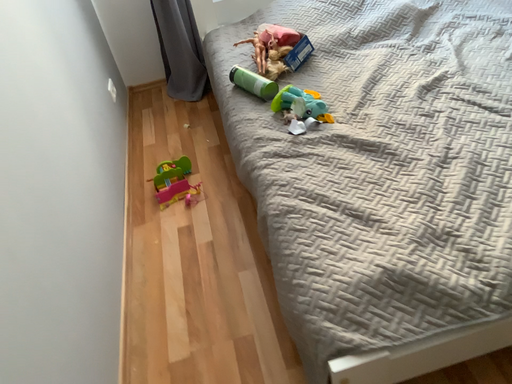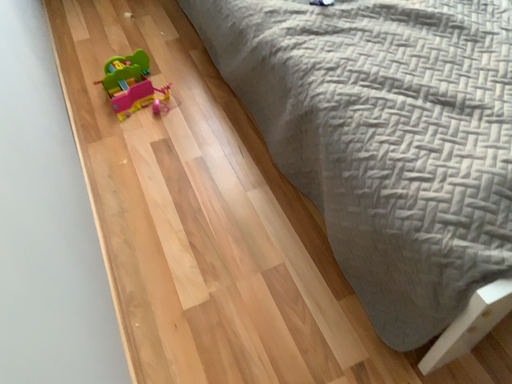
Question: How did the camera likely rotate when shooting the video?

Choices:
 (A) rotated upward
 (B) rotated downward

Answer: (B)